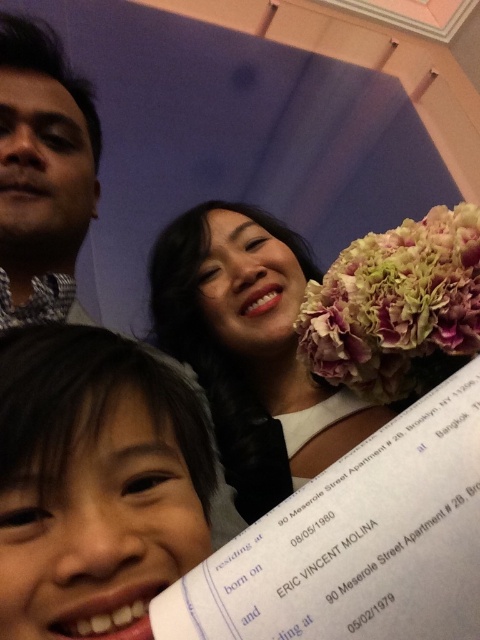
You are a photographer trying to capture a closeup of the smooth skin face at lower left without the pink matte flower at right appearing in the background. Based on the scene description, is this possible?

Yes, the smooth skin face at lower left is in front of the pink matte flower at right, so the flower will not appear in the background if the photographer focuses on the face.

You are standing in front of the image and want to touch the two points mentioned. Which point, point (399,266) or point (58,198), is closer to your hand?

Point (399,266) is closer to the viewer than point (58,198), so it is closer to your hand.

You are a photographer adjusting your camera to focus on two specific points in the image. The first point is at coordinates point [228,349] and the second is at point [407,278]. Which point should you focus on first if you want to capture the closest object to the camera?

Point [228,349] is further to the camera than point [407,278], so you should focus on point [228,349] first as it is closer to the camera.